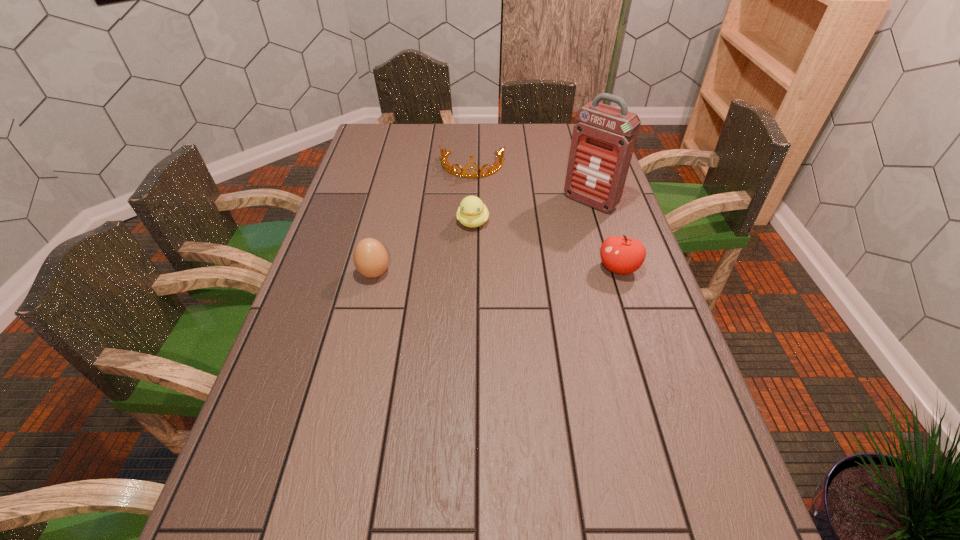
The width and height of the screenshot is (960, 540). I want to click on vacant space at the far edge, so click(x=409, y=129).

In the image, there is a desktop. Where is `vacant space at the near edge`? The width and height of the screenshot is (960, 540). vacant space at the near edge is located at coordinates (321, 500).

Where is `blank space at the left edge`? blank space at the left edge is located at coordinates tap(364, 166).

In order to click on free point at the right edge in this screenshot , I will do `click(659, 385)`.

You are a GUI agent. You are given a task and a screenshot of the screen. Output one action in this format:
    pyautogui.click(x=<x>, y=<y>)
    Task: Click on the vacant point at the far left corner
    This screenshot has width=960, height=540.
    Given the screenshot: What is the action you would take?
    pyautogui.click(x=396, y=132)

Locate an element on the screen. The height and width of the screenshot is (540, 960). free space at the near left corner is located at coordinates (296, 497).

Find the location of a particular element. vacant area between the boiled egg and the farthest object is located at coordinates (423, 220).

Find the location of a particular element. empty location between the farthest object and the leftmost object is located at coordinates (423, 220).

Locate an element on the screen. unoccupied area between the tiara and the apple is located at coordinates (545, 217).

This screenshot has height=540, width=960. What are the coordinates of `unoccupied area between the tallest object and the apple` in the screenshot? It's located at (604, 235).